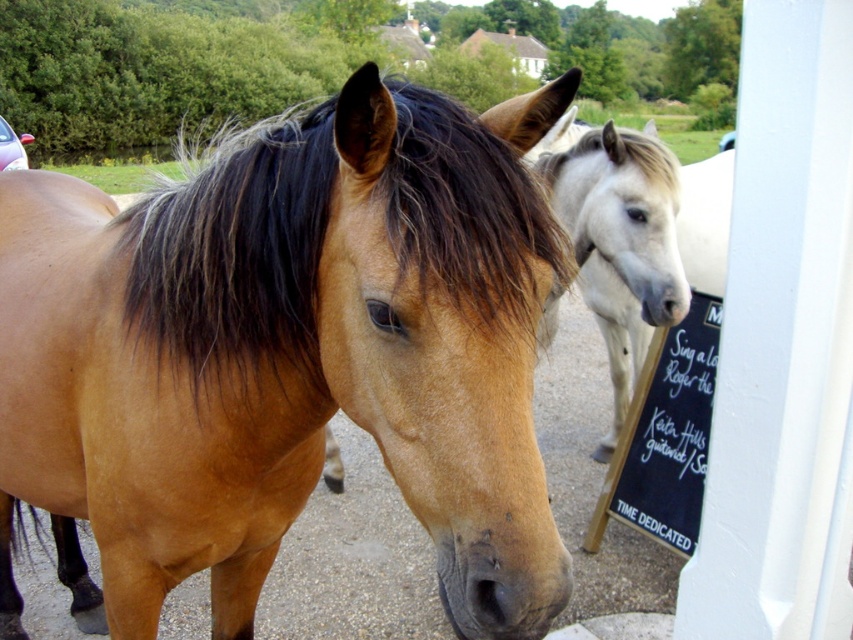
You are a photographer trying to capture a photo of the brown glossy horse at center and the black chalkboard at right. Based on their positions, which object is closer to the left side of the frame?

The brown glossy horse at center is closer to the left side of the frame than the black chalkboard at right.

You are a photographer trying to capture both the white glossy horse at center and the black chalkboard at right in a single frame. Based on their sizes, which one should you focus on first to ensure they both fit in the photo?

The white glossy horse at center is taller than the black chalkboard at right, so you should focus on the white glossy horse at center first to ensure both fit in the photo.